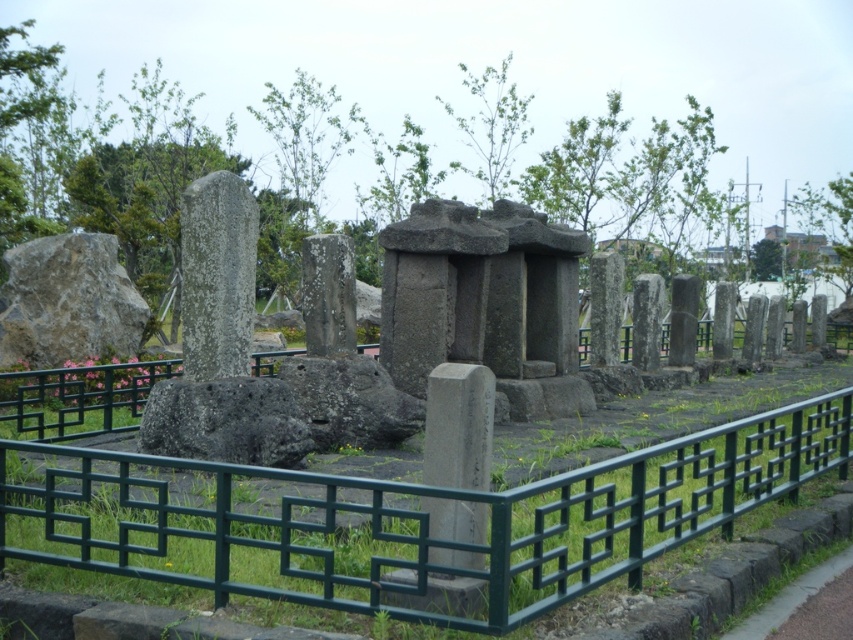
Question: Can you confirm if lichen-covered stone monument at center is thinner than smooth gray stone monument at center?

Choices:
 (A) no
 (B) yes

Answer: (A)

Question: From the image, what is the correct spatial relationship of green metal fence at center in relation to lichen-covered stone monument at center?

Choices:
 (A) above
 (B) below

Answer: (B)

Question: Considering the real-world distances, which object is farthest from the green metal fence at center?

Choices:
 (A) smooth gray stone monument at center
 (B) gray stone pillar at center
 (C) lichen-covered stone monument at center

Answer: (A)

Question: From the image, what is the correct spatial relationship of green metal fence at center in relation to lichen-covered stone monument at center?

Choices:
 (A) below
 (B) above

Answer: (A)

Question: Which of the following is the closest to the observer?

Choices:
 (A) green metal fence at center
 (B) smooth gray stone monument at center
 (C) gray stone pillar at center
 (D) lichen-covered stone monument at center

Answer: (A)

Question: Among these points, which one is farthest from the camera?

Choices:
 (A) (335, 252)
 (B) (238, 376)

Answer: (A)